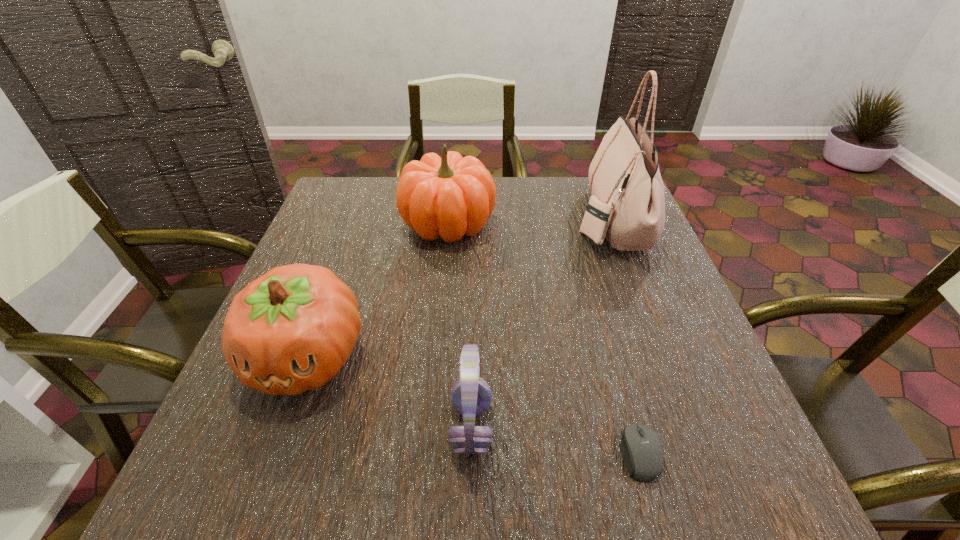
The image size is (960, 540). What are the coordinates of `object that is positioned at the far right corner` in the screenshot? It's located at (627, 205).

Identify the location of object situated at the near right corner. (642, 452).

Where is `vacant area at the far edge`? This screenshot has height=540, width=960. vacant area at the far edge is located at coordinates (571, 222).

In the image, there is a desktop. Identify the location of vacant space at the near edge. (308, 500).

In the image, there is a desktop. Find the location of `vacant space at the left edge`. vacant space at the left edge is located at coordinates (306, 426).

Find the location of a particular element. The image size is (960, 540). vacant space at the right edge of the desktop is located at coordinates (630, 296).

Identify the location of vacant space at the far left corner of the desktop. (367, 194).

This screenshot has height=540, width=960. In the image, there is a desktop. In order to click on vacant space at the near left corner in this screenshot , I will do `click(212, 470)`.

Where is `vacant space at the near right corner`? vacant space at the near right corner is located at coordinates (736, 501).

Identify the location of vacant space in between the left pumpkin and the farther pumpkin. (377, 290).